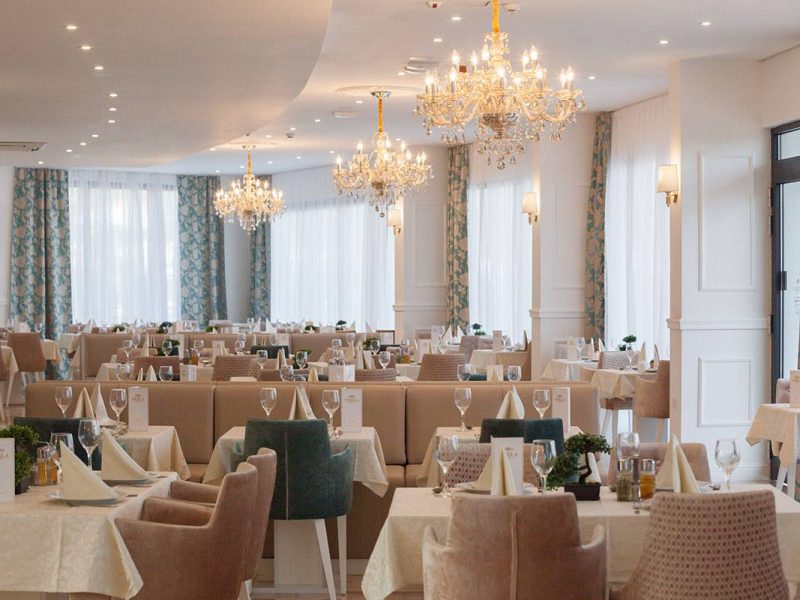
What are the coordinates of `drape` in the screenshot? It's located at (594, 235), (456, 252), (260, 268), (201, 265), (42, 265).